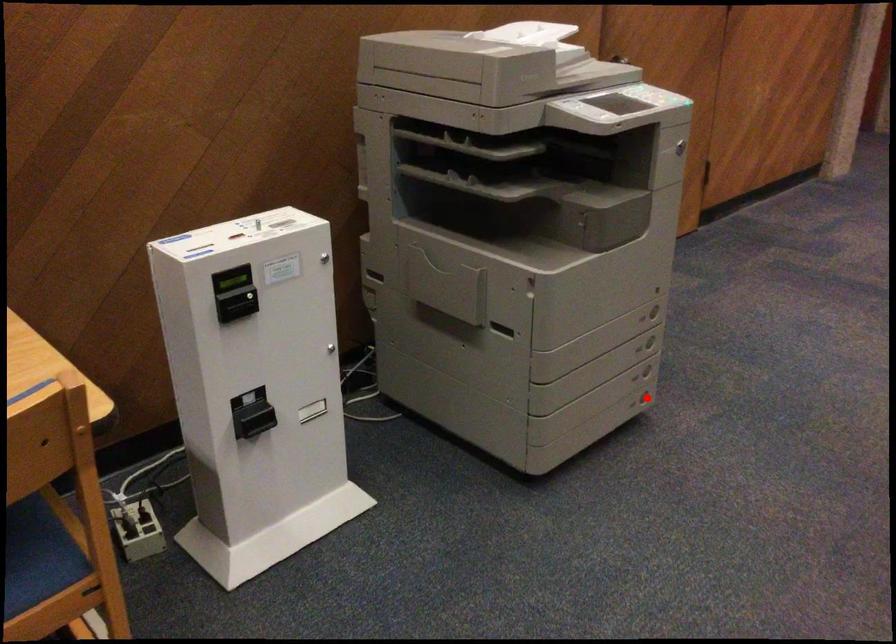
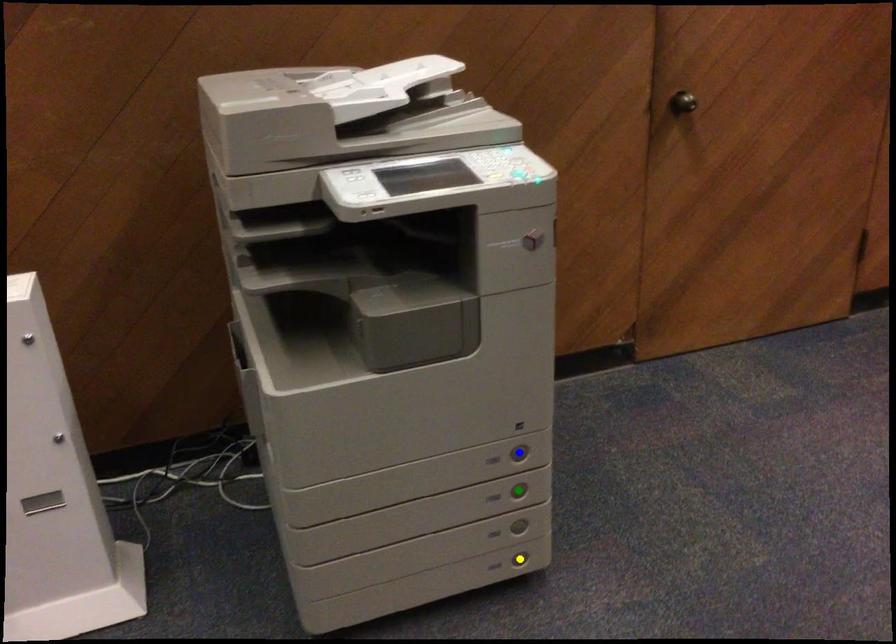
Question: I am providing you with two images of the same scene from different viewpoints. A red point is marked on the first image. You are given multiple points on the second image. Which point in image 2 is actually the same real-world point as the red point in image 1?

Choices:
 (A) blue point
 (B) green point
 (C) yellow point

Answer: (C)